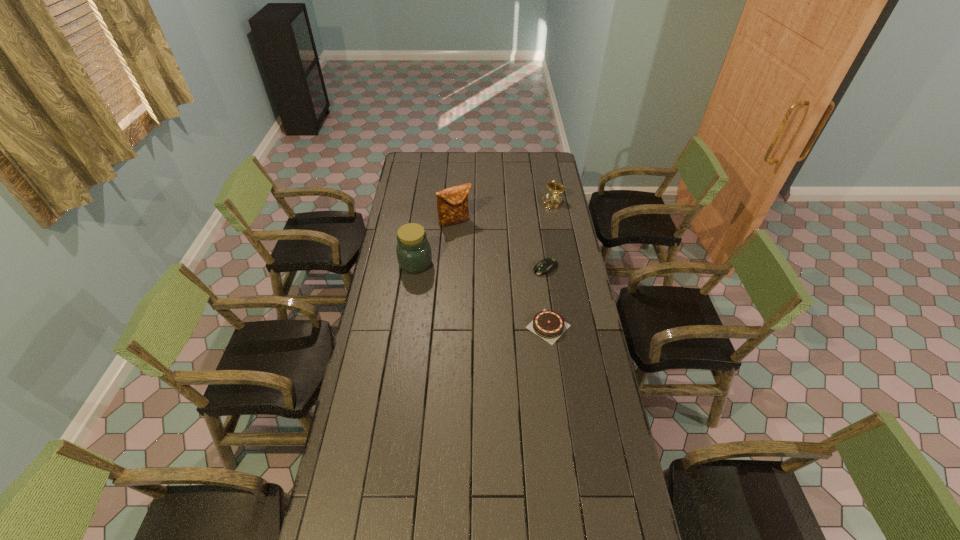
The width and height of the screenshot is (960, 540). Find the location of `computer mouse that is at the right edge`. computer mouse that is at the right edge is located at coordinates (547, 265).

What are the coordinates of `compass positioned at the right edge` in the screenshot? It's located at (552, 200).

What are the coordinates of `vacant region at the far edge of the desktop` in the screenshot? It's located at (437, 168).

In the image, there is a desktop. Identify the location of vacant space at the near edge. (434, 517).

Where is `vacant space at the left edge of the desktop`? Image resolution: width=960 pixels, height=540 pixels. vacant space at the left edge of the desktop is located at coordinates (339, 455).

Find the location of a particular element. vacant space at the right edge of the desktop is located at coordinates (540, 206).

Find the location of a particular element. This screenshot has width=960, height=540. vacant area at the far left corner is located at coordinates (413, 168).

Identify the location of vacant region at the near left corner of the desktop. (336, 503).

Locate an element on the screen. Image resolution: width=960 pixels, height=540 pixels. free point between the nearest object and the jar is located at coordinates (482, 295).

At what (x,y) coordinates should I click in order to perform the action: click on empty space between the jar and the computer mouse. Please return your answer as a coordinate pair (x, y). The image size is (960, 540). Looking at the image, I should click on (481, 266).